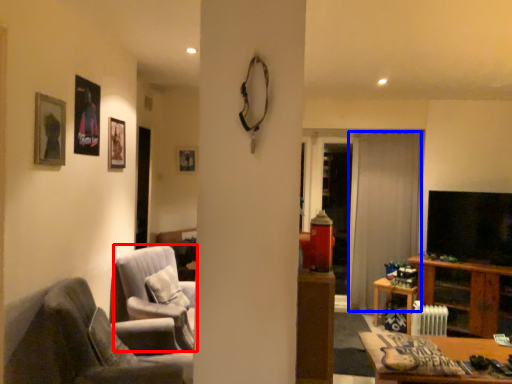
Question: Which object is closer to the camera taking this photo, chair (highlighted by a red box) or curtain (highlighted by a blue box)?

Choices:
 (A) chair
 (B) curtain

Answer: (A)